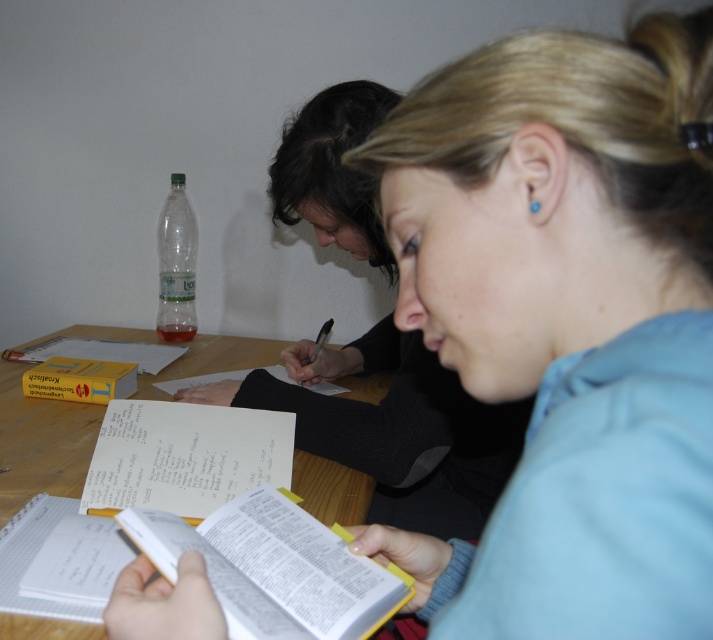
You are organizing a small event and need to place a decorative item on the table. The transparent plastic bottle at upper left is intended to hold flowers. However, you also have a large smooth black sweater at center that you want to place nearby. Considering their sizes, which object should you prioritize placing first to ensure both fit comfortably on the table?

The smooth black sweater at center is larger than the transparent plastic bottle at upper left. You should prioritize placing the smooth black sweater at center first to ensure there is enough space left for the transparent plastic bottle at upper left.

You are a student who needs to reach for the transparent plastic bottle at upper left during your study session. However, you are currently holding the white paper notebook at center. Can you easily access the bottle without moving the notebook?

The white paper notebook at center is in front of the transparent plastic bottle at upper left, so you cannot easily access the bottle without moving the notebook.

You are a student who needs to place a 10 cm wide notebook between the smooth black sweater at center and the white paper book at center. Is there enough space?

The smooth black sweater at center is positioned on the right side of white paper book at center, so there is space between them. The notebook can be placed between the smooth black sweater at center and the white paper book at center.